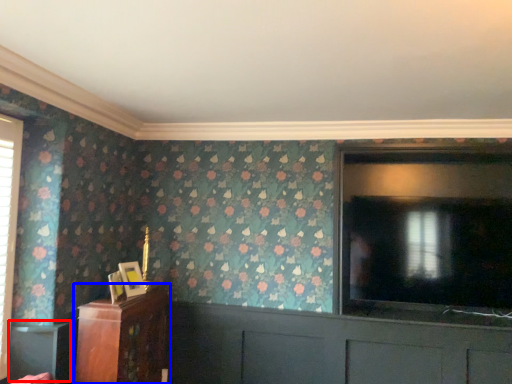
Question: Among these objects, which one is nearest to the camera, table (highlighted by a red box) or furniture (highlighted by a blue box)?

Choices:
 (A) table
 (B) furniture

Answer: (A)